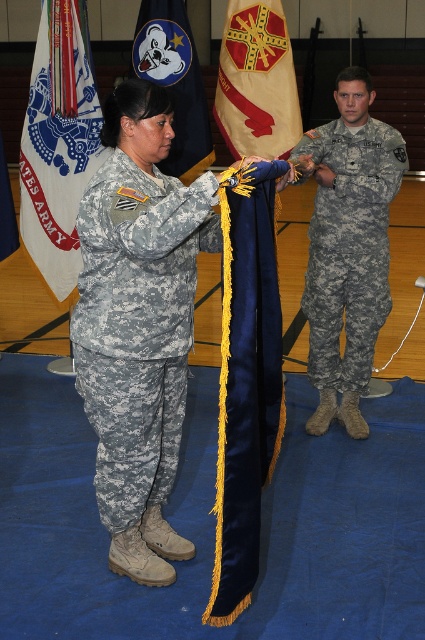
Which is above, camouflage fabric uniform at center or camouflage fabric uniform at right?

camouflage fabric uniform at right is above.

Between camouflage fabric uniform at center and camouflage fabric uniform at right, which one has less height?

camouflage fabric uniform at center

Between point (105, 291) and point (379, 273), which one is positioned in front?

Point (105, 291)

Locate an element on the screen. camouflage fabric uniform at center is located at coordinates (138, 324).

Is camouflage fabric uniform at right smaller than blue felt flag at upper center?

Yes.

Where is `camouflage fabric uniform at right`? The width and height of the screenshot is (425, 640). camouflage fabric uniform at right is located at coordinates (348, 248).

Does point (345, 208) come closer to viewer compared to point (184, 92)?

Yes, point (345, 208) is closer to viewer.

Find the location of a particular element. This screenshot has width=425, height=640. camouflage fabric uniform at right is located at coordinates (348, 248).

Which of these two, white fabric flag at left or blue felt flag at upper center, stands taller?

With more height is white fabric flag at left.

This screenshot has height=640, width=425. What do you see at coordinates (59, 141) in the screenshot?
I see `white fabric flag at left` at bounding box center [59, 141].

Does point (73, 10) come farther from viewer compared to point (193, 67)?

No, (73, 10) is closer to viewer.

This screenshot has width=425, height=640. I want to click on white fabric flag at left, so click(x=59, y=141).